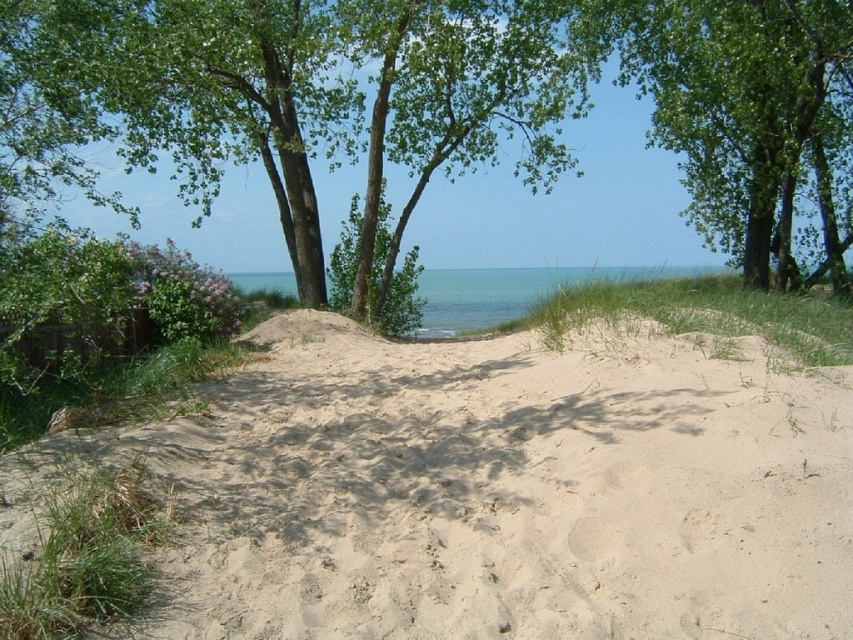
Question: Which object is the farthest from the light beige sand at center?

Choices:
 (A) green leafy tree at center
 (B) green leafy tree at upper right

Answer: (A)

Question: Can you confirm if light beige sand at center is positioned above blue water at center?

Choices:
 (A) no
 (B) yes

Answer: (A)

Question: Among these points, which one is nearest to the camera?

Choices:
 (A) (424, 323)
 (B) (689, 579)
 (C) (445, 45)
 (D) (728, 36)

Answer: (B)

Question: Among these objects, which one is farthest from the camera?

Choices:
 (A) blue water at center
 (B) green leafy tree at upper right
 (C) light beige sand at center

Answer: (B)

Question: Is green leafy tree at upper right to the right of blue water at center from the viewer's perspective?

Choices:
 (A) no
 (B) yes

Answer: (B)

Question: Is light beige sand at center smaller than green leafy tree at upper right?

Choices:
 (A) yes
 (B) no

Answer: (B)